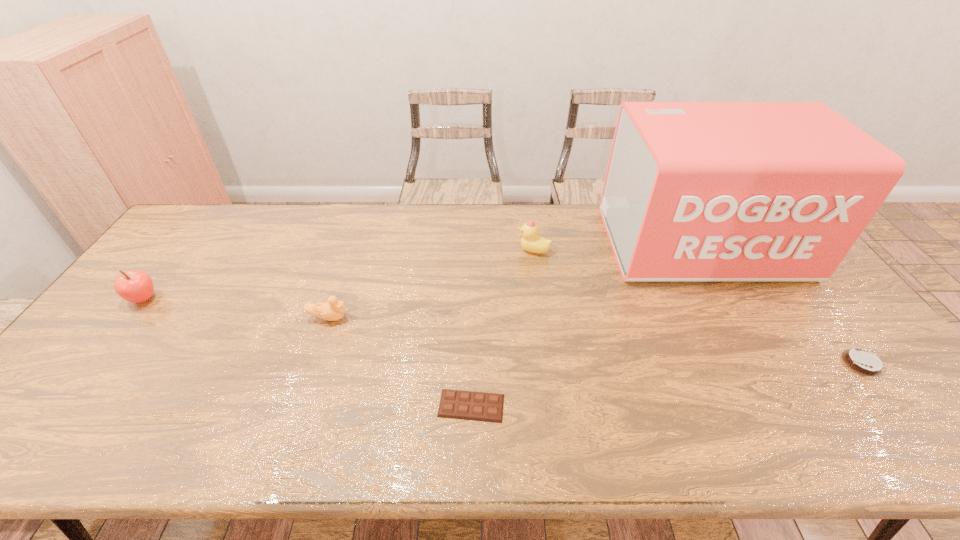
Identify the location of the tallest object. The height and width of the screenshot is (540, 960). (694, 191).

Image resolution: width=960 pixels, height=540 pixels. Identify the location of the right duckling. (531, 241).

Find the location of `the third object from right to left`. the third object from right to left is located at coordinates (531, 241).

Find the location of `apple`. apple is located at coordinates (135, 286).

This screenshot has height=540, width=960. I want to click on the leftmost object, so click(135, 286).

You are a GUI agent. You are given a task and a screenshot of the screen. Output one action in this format:
    pyautogui.click(x=<x>, y=<y>)
    Task: Click on the nearer duckling
    The image size is (960, 540).
    Given the screenshot: What is the action you would take?
    (x=333, y=309)

At what (x,y) coordinates should I click in order to perform the action: click on the fourth tallest object. Please return your answer as a coordinate pair (x, y). The height and width of the screenshot is (540, 960). Looking at the image, I should click on (333, 309).

This screenshot has height=540, width=960. In order to click on chocolate cake in this screenshot , I will do `click(863, 362)`.

Where is `the fifth farthest object`? The height and width of the screenshot is (540, 960). the fifth farthest object is located at coordinates (863, 362).

Where is `chocolate bar`? This screenshot has width=960, height=540. chocolate bar is located at coordinates (467, 405).